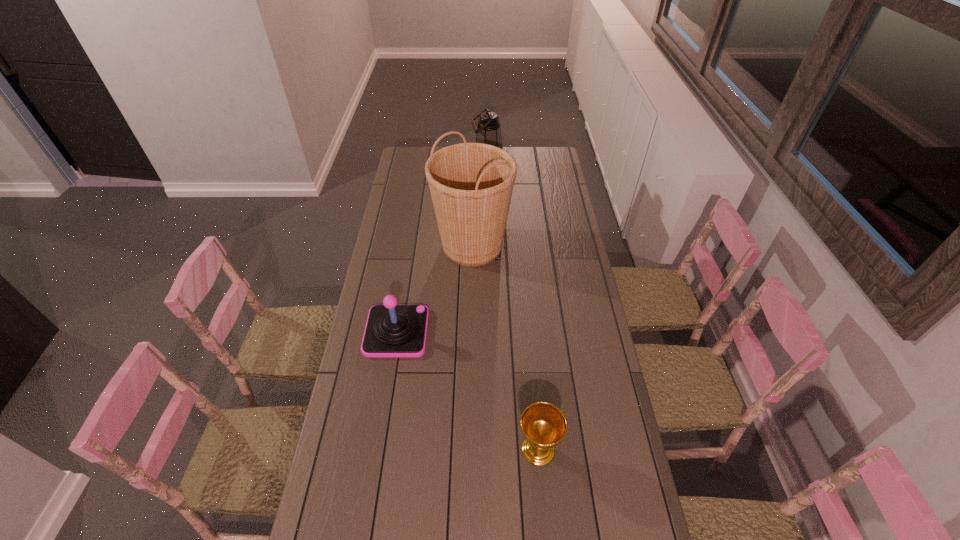
I want to click on the tallest object, so click(x=471, y=184).

Where is `basket`? Image resolution: width=960 pixels, height=540 pixels. basket is located at coordinates (471, 184).

You are a GUI agent. You are given a task and a screenshot of the screen. Output one action in this format:
    pyautogui.click(x=<x>, y=<y>)
    Task: Click on the farthest object
    The height and width of the screenshot is (540, 960).
    Given the screenshot: What is the action you would take?
    pyautogui.click(x=488, y=131)

Image resolution: width=960 pixels, height=540 pixels. Find the location of `the third shortest object`. the third shortest object is located at coordinates (488, 131).

You are a GUI agent. You are given a task and a screenshot of the screen. Output one action in this format:
    pyautogui.click(x=<x>, y=<y>)
    Task: Click on the joystick
    The width and height of the screenshot is (960, 540).
    Given the screenshot: What is the action you would take?
    pyautogui.click(x=392, y=330)

Locate an element on the screen. Image resolution: width=960 pixels, height=540 pixels. the shortest object is located at coordinates (543, 425).

Find the location of a particular element. Image resolution: width=960 pixels, height=540 pixels. chalice is located at coordinates 543,425.

Identify the location of blank area located 0.280m on the back of the tallest object. (473, 187).

At what (x,y) coordinates should I click in order to perform the action: click on vacant point located 0.170m on the back of the second tallest object. Please return your answer as a coordinate pair (x, y). The height and width of the screenshot is (540, 960). Looking at the image, I should click on (488, 147).

At what (x,y) coordinates should I click in order to perform the action: click on vacant region located 0.130m forward from the base of the third farthest object. Please return your answer as a coordinate pair (x, y). Looking at the image, I should click on (462, 332).